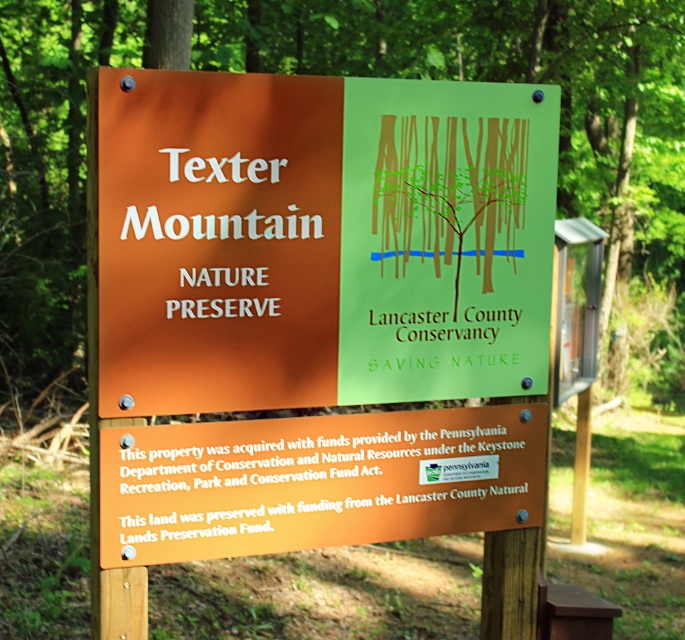
Does matte orange sign at center appear on the left side of green matte signboard at center?

Correct, you'll find matte orange sign at center to the left of green matte signboard at center.

Between matte orange sign at center and green matte signboard at center, which one has more height?

matte orange sign at center is taller.

This screenshot has height=640, width=685. What are the coordinates of `matte orange sign at center` in the screenshot? It's located at (319, 241).